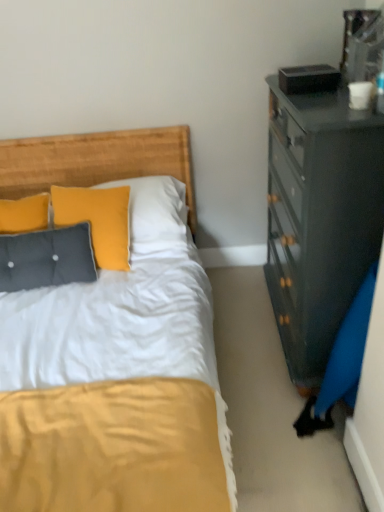
Question: Considering their positions, is tufted fabric pillow at left located in front of or behind wooden headboard at upper left?

Choices:
 (A) behind
 (B) front

Answer: (B)

Question: Would you say tufted fabric pillow at left is to the left or to the right of wooden headboard at upper left in the picture?

Choices:
 (A) right
 (B) left

Answer: (B)

Question: In terms of size, does tufted fabric pillow at left appear bigger or smaller than wooden headboard at upper left?

Choices:
 (A) small
 (B) big

Answer: (A)

Question: Based on their positions, is wooden headboard at upper left located to the left or right of tufted fabric pillow at left?

Choices:
 (A) right
 (B) left

Answer: (A)

Question: Is point (84, 155) closer or farther from the camera than point (44, 241)?

Choices:
 (A) farther
 (B) closer

Answer: (A)

Question: Do you think wooden headboard at upper left is within tufted fabric pillow at left, or outside of it?

Choices:
 (A) inside
 (B) outside

Answer: (B)

Question: From a real-world perspective, is wooden headboard at upper left positioned above or below tufted fabric pillow at left?

Choices:
 (A) above
 (B) below

Answer: (A)